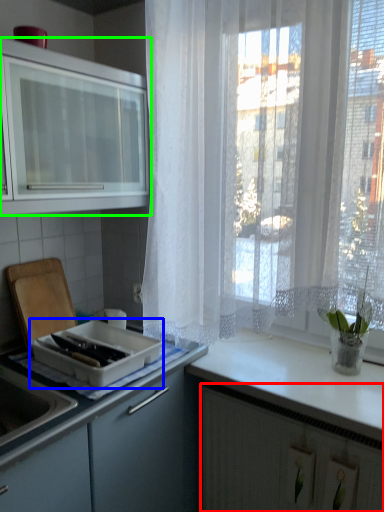
Question: Which object is the closest to the cabinetry (highlighted by a red box)? Choose among these: kitchen appliance (highlighted by a blue box) or cabinetry (highlighted by a green box).

Choices:
 (A) kitchen appliance
 (B) cabinetry

Answer: (A)